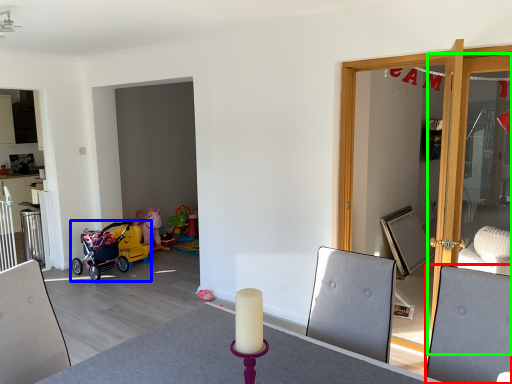
Question: Based on their relative distances, which object is farther from swivel chair (highlighted by a red box)? Choose from stroller (highlighted by a blue box) and door (highlighted by a green box).

Choices:
 (A) stroller
 (B) door

Answer: (A)